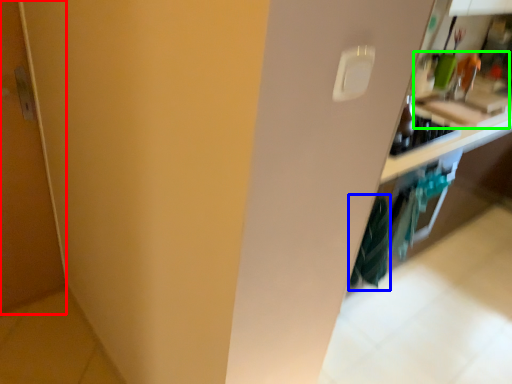
Question: Which object is positioned farthest from door (highlighted by a red box)? Select from laundry (highlighted by a blue box) and sink (highlighted by a green box).

Choices:
 (A) laundry
 (B) sink

Answer: (B)